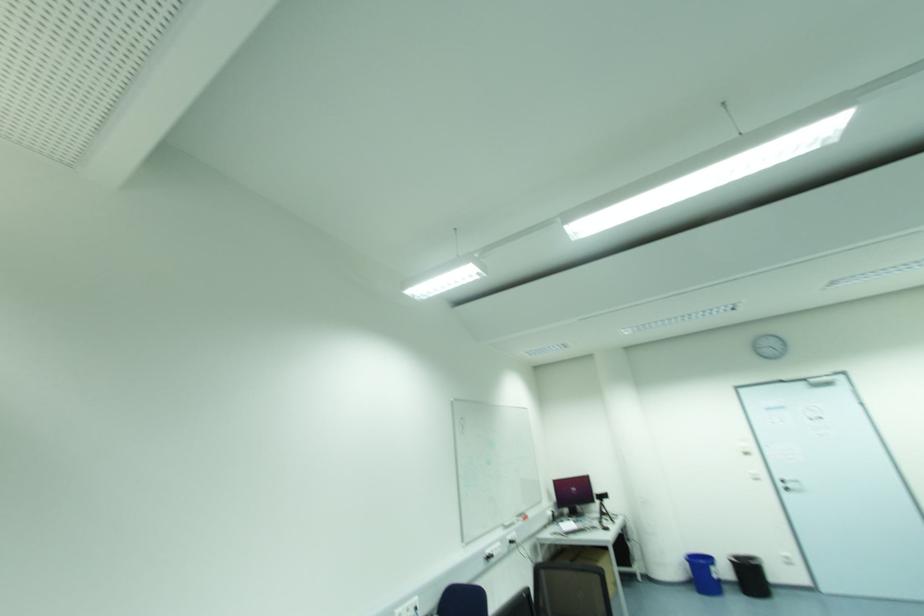
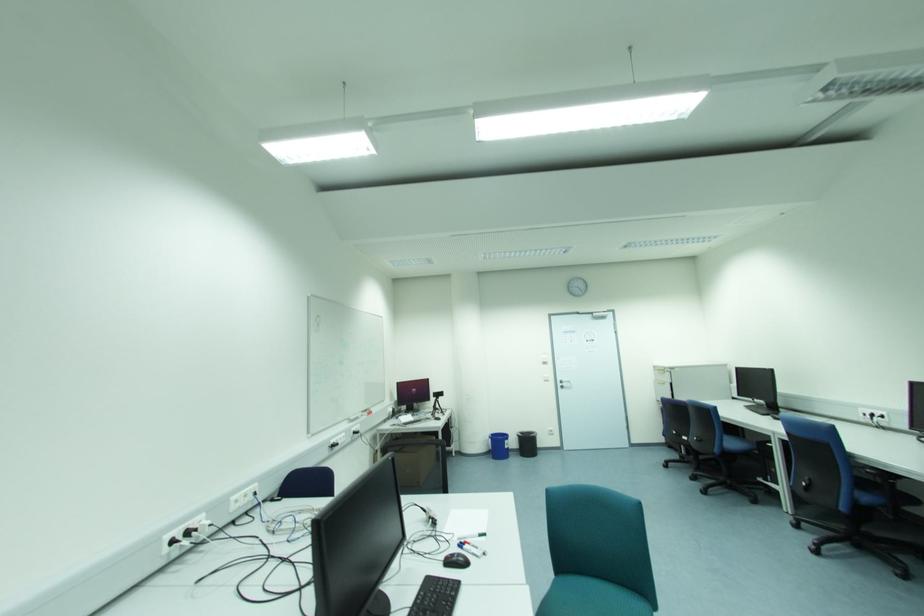
Question: The first image is from the beginning of the video and the second image is from the end. How did the camera likely rotate when shooting the video?

Choices:
 (A) Left
 (B) Right
 (C) Up
 (D) Down

Answer: (B)